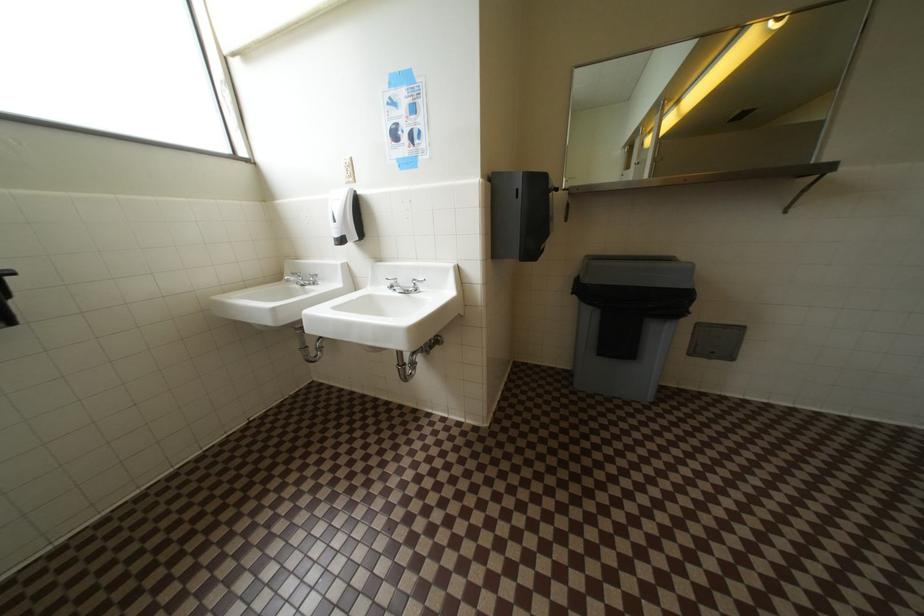
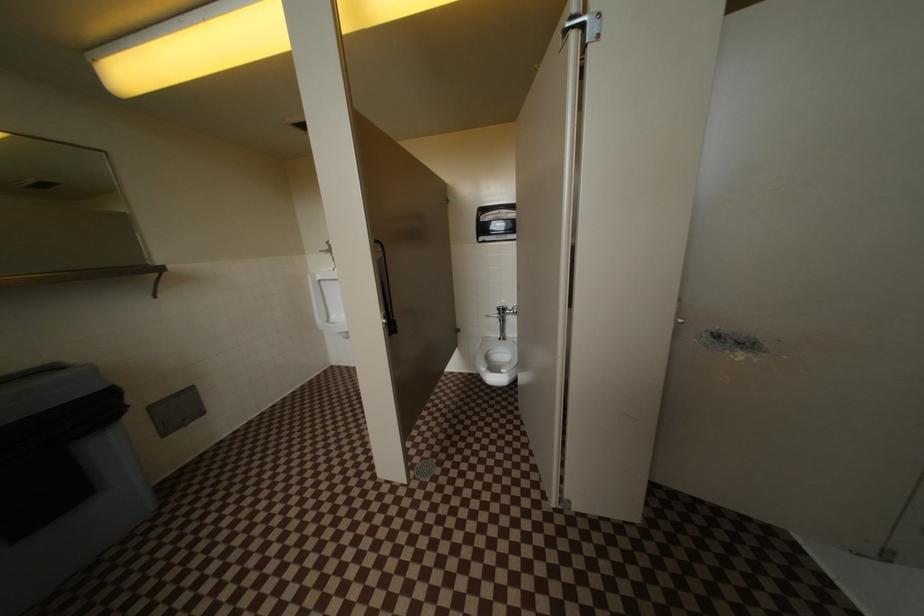
How did the camera likely rotate?

The rotation direction of the camera is right-down.